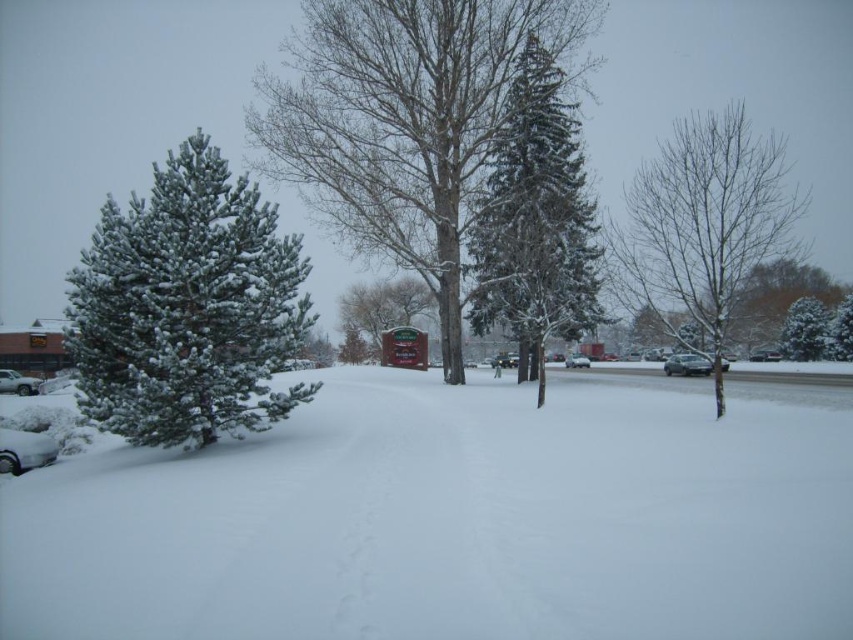
Question: Which object is closer to the camera taking this photo?

Choices:
 (A) green matte tree at right
 (B) white matte car at lower left

Answer: (A)

Question: Among these objects, which one is nearest to the camera?

Choices:
 (A) sleek silver sedan at center
 (B) green textured sign at center

Answer: (B)

Question: Can you confirm if snow-covered evergreen tree at center is positioned below snow-covered evergreen at center?

Choices:
 (A) no
 (B) yes

Answer: (A)

Question: Which of the following is the closest to the observer?

Choices:
 (A) green textured sign at center
 (B) white fluffy snow at center
 (C) snow-covered evergreen at center
 (D) green matte pine tree at left

Answer: (B)

Question: Does green matte pine tree at left appear under green matte tree at center?

Choices:
 (A) yes
 (B) no

Answer: (B)

Question: Does green matte tree at center appear under sleek silver sedan at center?

Choices:
 (A) yes
 (B) no

Answer: (B)